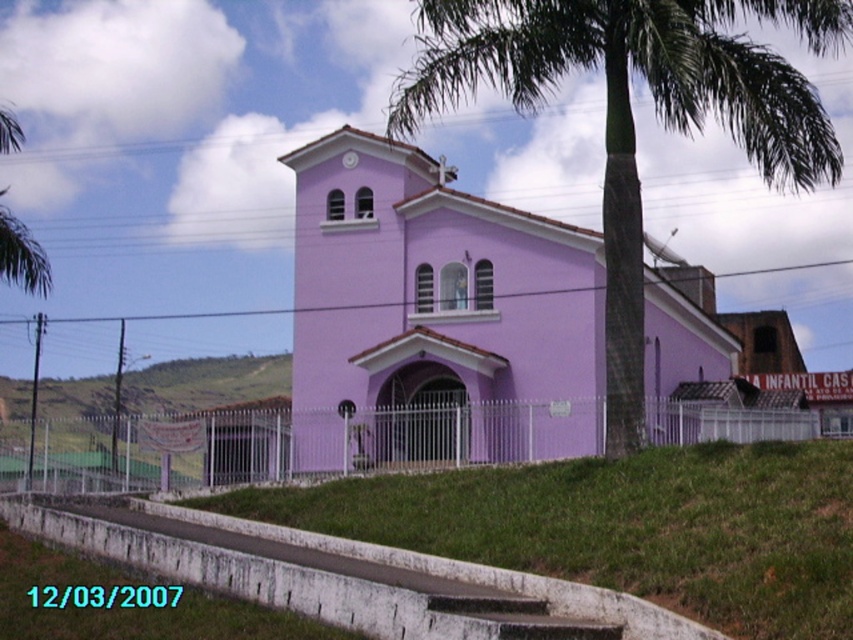
Who is positioned more to the right, matte purple church at center or green leafy palm tree at center?

green leafy palm tree at center is more to the right.

Is point (440, 314) positioned behind point (833, 147)?

Yes, point (440, 314) is behind point (833, 147).

This screenshot has height=640, width=853. Find the location of `matte purple church at center`. matte purple church at center is located at coordinates (437, 310).

Does point (712, 339) come farther from viewer compared to point (148, 412)?

No, (712, 339) is in front of (148, 412).

How much distance is there between matte purple church at center and green grassy hillside at lower left?

They are 65.11 meters apart.

Does point (575, 392) come behind point (219, 385)?

No, (575, 392) is closer to viewer.

This screenshot has height=640, width=853. What are the coordinates of `matte purple church at center` in the screenshot? It's located at (437, 310).

Consider the image. Does green leafy palm tree at center appear on the left side of green grassy hillside at lower left?

In fact, green leafy palm tree at center is to the right of green grassy hillside at lower left.

Locate an element on the screen. green leafy palm tree at center is located at coordinates (631, 113).

At what (x,y) coordinates should I click in order to perform the action: click on green leafy palm tree at center. Please return your answer as a coordinate pair (x, y). Looking at the image, I should click on (631, 113).